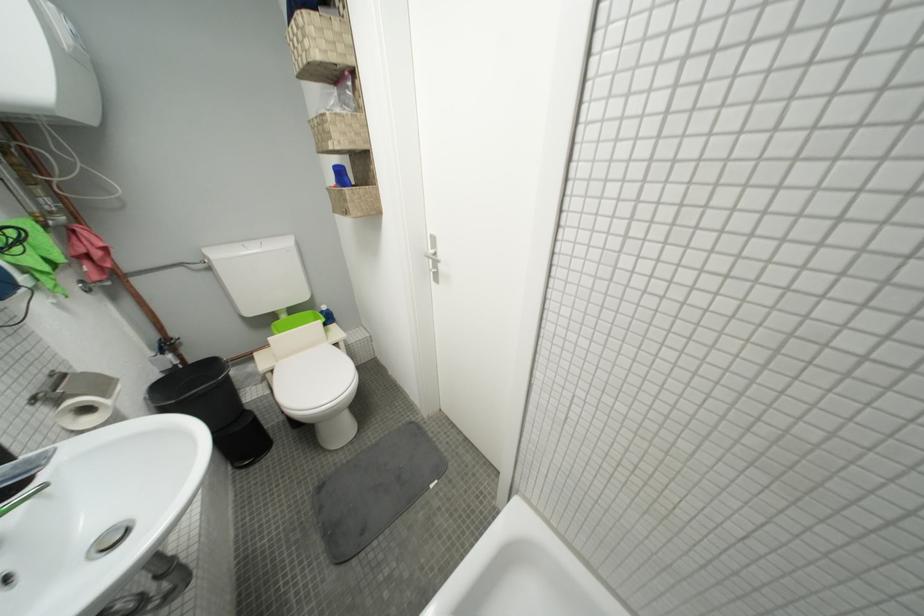
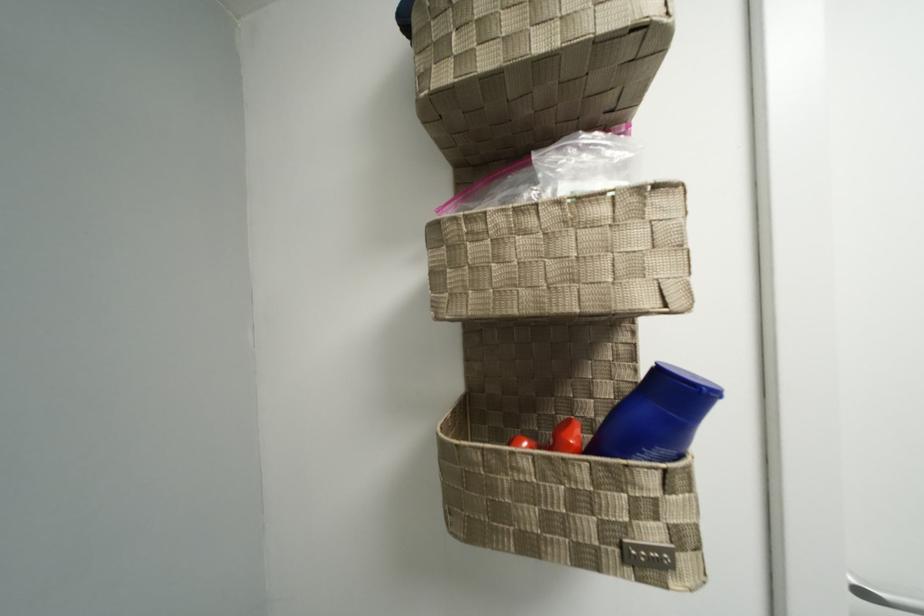
Find the pixel in the second image that matches point (343, 185) in the first image.

(689, 450)